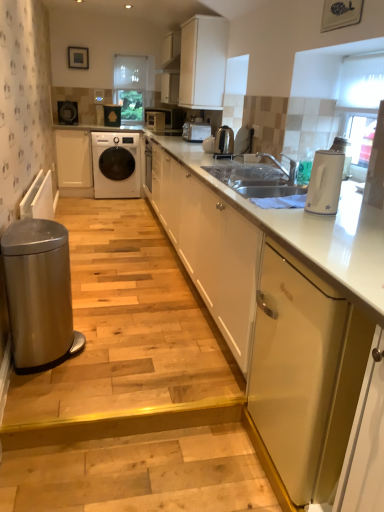
Question: Should I look upward or downward to see white fabric at center?

Choices:
 (A) up
 (B) down

Answer: (A)

Question: From a real-world perspective, is satin nickel kettle at center beneath white glossy electric kettle at right?

Choices:
 (A) no
 (B) yes

Answer: (B)

Question: Does satin nickel kettle at center come behind white glossy electric kettle at right?

Choices:
 (A) no
 (B) yes

Answer: (B)

Question: Is satin nickel kettle at center closer to the viewer compared to white glossy electric kettle at right?

Choices:
 (A) yes
 (B) no

Answer: (B)

Question: Does satin nickel kettle at center have a larger size compared to white glossy electric kettle at right?

Choices:
 (A) no
 (B) yes

Answer: (A)

Question: Does satin nickel kettle at center have a greater width compared to white glossy electric kettle at right?

Choices:
 (A) no
 (B) yes

Answer: (A)

Question: Is white glossy electric kettle at right completely or partially inside satin nickel kettle at center?

Choices:
 (A) yes
 (B) no

Answer: (B)

Question: Does metallic silver toaster at upper center, which ranks as the first appliance in right-to-left order, have a greater height compared to white glossy electric kettle at right?

Choices:
 (A) no
 (B) yes

Answer: (A)

Question: Is metallic silver toaster at upper center, which ranks as the fifth appliance in top-to-bottom order, positioned with its back to white glossy electric kettle at right?

Choices:
 (A) no
 (B) yes

Answer: (A)

Question: Is metallic silver toaster at upper center, which ranks as the fifth appliance in back-to-front order, next to white glossy electric kettle at right?

Choices:
 (A) yes
 (B) no

Answer: (B)

Question: From the image's perspective, is metallic silver toaster at upper center, which ranks as the first appliance in right-to-left order, beneath white glossy electric kettle at right?

Choices:
 (A) no
 (B) yes

Answer: (A)

Question: From a real-world perspective, is metallic silver toaster at upper center, which ranks as the fifth appliance in top-to-bottom order, positioned under white glossy electric kettle at right based on gravity?

Choices:
 (A) no
 (B) yes

Answer: (B)

Question: Is metallic silver toaster at upper center, which ranks as the fifth appliance in back-to-front order, to the left of white glossy electric kettle at right from the viewer's perspective?

Choices:
 (A) no
 (B) yes

Answer: (B)

Question: Considering the relative sizes of metallic gold dishwasher at right and metallic silver toaster at upper center, which ranks as the fifth appliance in top-to-bottom order, in the image provided, is metallic gold dishwasher at right taller than metallic silver toaster at upper center, which ranks as the fifth appliance in top-to-bottom order,?

Choices:
 (A) yes
 (B) no

Answer: (A)